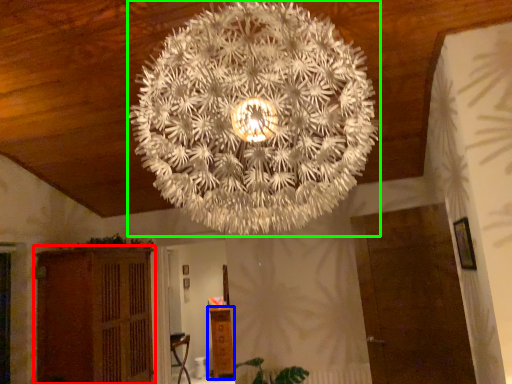
Question: Which object is positioned farthest from furniture (highlighted by a red box)? Select from furniture (highlighted by a blue box) and lamp (highlighted by a green box).

Choices:
 (A) furniture
 (B) lamp

Answer: (B)